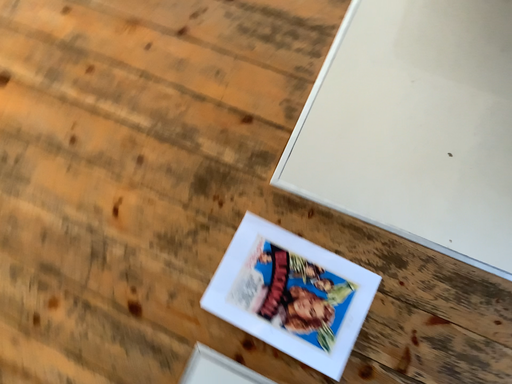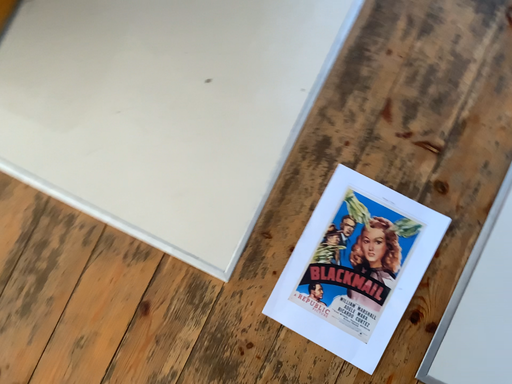
Question: Which way did the camera rotate in the video?

Choices:
 (A) rotated right
 (B) rotated left

Answer: (A)